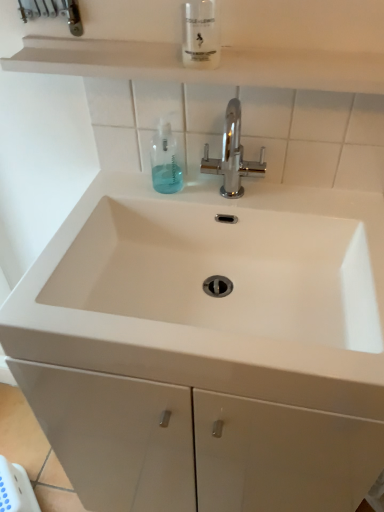
The width and height of the screenshot is (384, 512). In order to click on vacant space that is to the left of clear plastic bottle at upper center, the 2th mouthwash positioned from the back in this screenshot , I will do `click(127, 51)`.